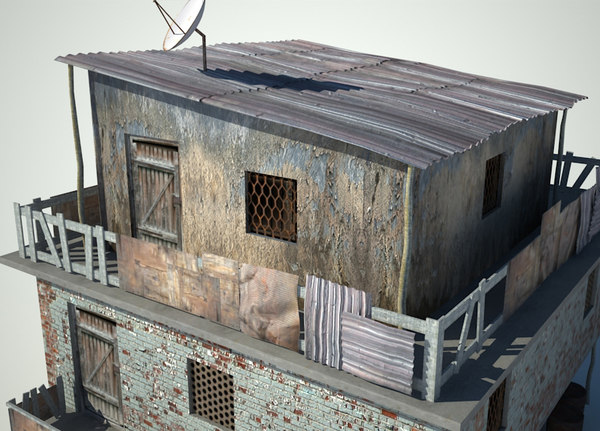
You are a GUI agent. You are given a task and a screenshot of the screen. Output one action in this format:
    pyautogui.click(x=<x>, y=<y>)
    Task: Click on the window
    
    Given the screenshot: What is the action you would take?
    point(500,187)